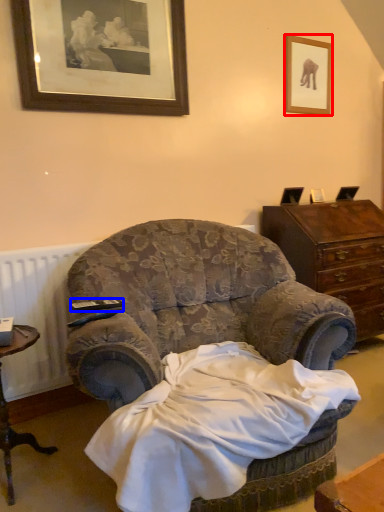
Question: Which point is further to the camera, picture frame (highlighted by a red box) or remote control (highlighted by a blue box)?

Choices:
 (A) picture frame
 (B) remote control

Answer: (A)